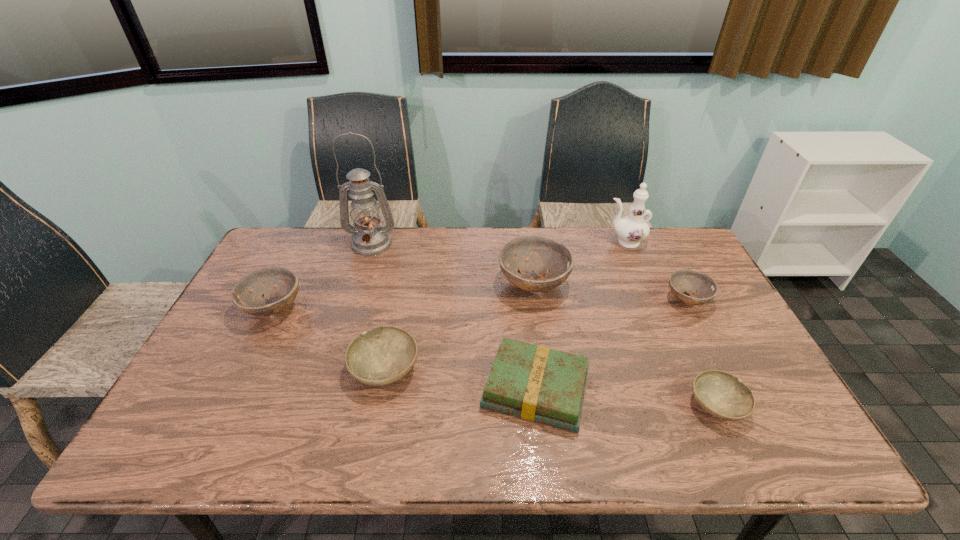
The height and width of the screenshot is (540, 960). I want to click on free space that is in between the chinaware and the shortest bowl, so click(670, 323).

This screenshot has width=960, height=540. What are the coordinates of `vacant space in between the tallest bowl and the gray oil lamp` in the screenshot? It's located at (452, 264).

Locate an element on the screen. The height and width of the screenshot is (540, 960). vacant space in between the smaller gray bowl and the smallest brown bowl is located at coordinates (702, 352).

Where is `vacant space that's between the tallest bowl and the oil lamp`? vacant space that's between the tallest bowl and the oil lamp is located at coordinates (452, 264).

I want to click on vacant area that lies between the fifth shortest object and the second tallest object, so click(x=449, y=275).

Find the location of `free spot between the shortest bowl and the rightmost brown bowl`. free spot between the shortest bowl and the rightmost brown bowl is located at coordinates (702, 352).

Where is `object that is the fifth closest to the seventh shortest object`? The height and width of the screenshot is (540, 960). object that is the fifth closest to the seventh shortest object is located at coordinates (383, 355).

In order to click on the seventh closest object to the second tallest object in this screenshot , I will do `click(246, 294)`.

Point out which bowl is positioned as the fifth nearest to the chinaware. Please provide its 2D coordinates. Your answer should be formatted as a tuple, i.e. [(x, y)], where the tuple contains the x and y coordinates of a point satisfying the conditions above.

[(246, 294)]

Locate an element on the screen. This screenshot has height=540, width=960. bowl that stands as the third closest to the left gray bowl is located at coordinates (721, 394).